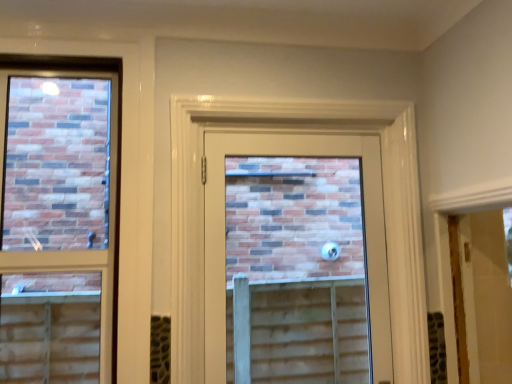
Find the location of a particular element. This screenshot has height=384, width=512. matte glass window at left is located at coordinates (57, 225).

What do you see at coordinates (57, 225) in the screenshot? I see `matte glass window at left` at bounding box center [57, 225].

What do you see at coordinates (224, 225) in the screenshot? Image resolution: width=512 pixels, height=384 pixels. I see `matte glass door at center` at bounding box center [224, 225].

The width and height of the screenshot is (512, 384). I want to click on matte glass door at center, so click(x=224, y=225).

What are the coordinates of `matte glass window at left` in the screenshot? It's located at (57, 225).

From the picture: Which is more to the left, matte glass window at left or matte glass door at center?

matte glass window at left is more to the left.

Considering the positions of objects matte glass window at left and matte glass door at center in the image provided, who is behind, matte glass window at left or matte glass door at center?

matte glass door at center is further away from the camera.

Does point (73, 73) appear closer or farther from the camera than point (210, 209)?

Point (73, 73) is closer to the camera than point (210, 209).

Consider the image. From the image's perspective, is matte glass window at left beneath matte glass door at center?

Actually, matte glass window at left appears above matte glass door at center in the image.

From a real-world perspective, which is physically above, matte glass window at left or matte glass door at center?

In real-world perspective, matte glass window at left is above.

Looking at their sizes, would you say matte glass window at left is wider or thinner than matte glass door at center?

Clearly, matte glass window at left has more width compared to matte glass door at center.

Looking at this image, between matte glass window at left and matte glass door at center, which one has less height?

matte glass door at center.

Which of these two, matte glass window at left or matte glass door at center, is bigger?

With larger size is matte glass door at center.

Choose the correct answer: Is matte glass window at left inside matte glass door at center or outside it?

matte glass window at left exists outside the volume of matte glass door at center.

Is matte glass window at left touching matte glass door at center?

No, matte glass window at left is not with matte glass door at center.

Is matte glass window at left aimed at matte glass door at center?

No, matte glass window at left is not aimed at matte glass door at center.

Find the location of a particular element. The height and width of the screenshot is (384, 512). door that appears below the matte glass window at left (from a real-world perspective) is located at coordinates (224, 225).

From the picture: Is matte glass door at center at the right side of matte glass window at left?

Indeed, matte glass door at center is positioned on the right side of matte glass window at left.

Is matte glass door at center in front of or behind matte glass window at left in the image?

Visually, matte glass door at center is located behind matte glass window at left.

Which is further, (360, 139) or (29, 379)?

The point (29, 379) is behind.

From the image's perspective, is matte glass door at center positioned above or below matte glass window at left?

matte glass door at center is below matte glass window at left.

From a real-world perspective, between matte glass door at center and matte glass window at left, who is vertically lower?

From a 3D spatial view, matte glass door at center is below.

Which object is wider, matte glass door at center or matte glass window at left?

matte glass window at left.

Between matte glass door at center and matte glass window at left, which one has less height?

With less height is matte glass door at center.

Who is bigger, matte glass door at center or matte glass window at left?

matte glass door at center.

From the picture: Is matte glass door at center completely or partially outside of matte glass window at left?

Yes, matte glass door at center is located beyond the bounds of matte glass window at left.

Is matte glass door at center not near matte glass window at left?

matte glass door at center is far away from matte glass window at left.

Is matte glass door at center aimed at matte glass window at left?

No, matte glass door at center is not oriented towards matte glass window at left.

Can you tell me how much matte glass door at center and matte glass window at left differ in facing direction?

The facing directions of matte glass door at center and matte glass window at left are 1.21 degrees apart.

How distant is matte glass door at center from matte glass window at left?

matte glass door at center is 2.66 meters away from matte glass window at left.

I want to click on door behind the matte glass window at left, so click(x=224, y=225).

The width and height of the screenshot is (512, 384). What are the coordinates of `door below the matte glass window at left (from a real-world perspective)` in the screenshot? It's located at (224, 225).

This screenshot has height=384, width=512. What are the coordinates of `window lying on the left of matte glass door at center` in the screenshot? It's located at (57, 225).